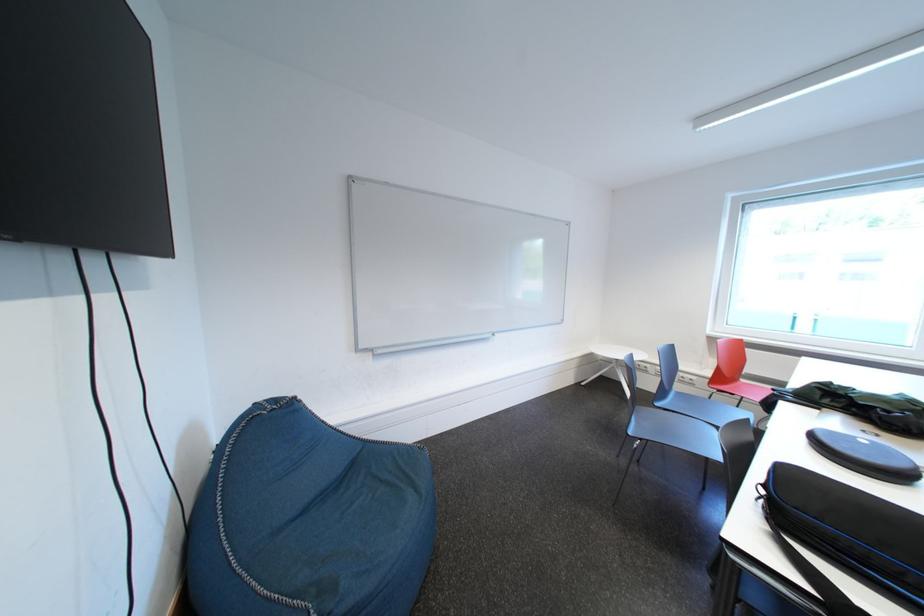
Find the location of a particular element. Image resolution: width=924 pixels, height=616 pixels. red chair sitting surface is located at coordinates (763, 382).